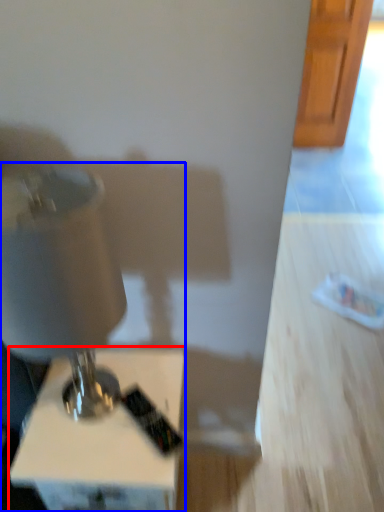
Question: Which object appears farthest to the camera in this image, furniture (highlighted by a red box) or sewing machine (highlighted by a blue box)?

Choices:
 (A) furniture
 (B) sewing machine

Answer: (A)